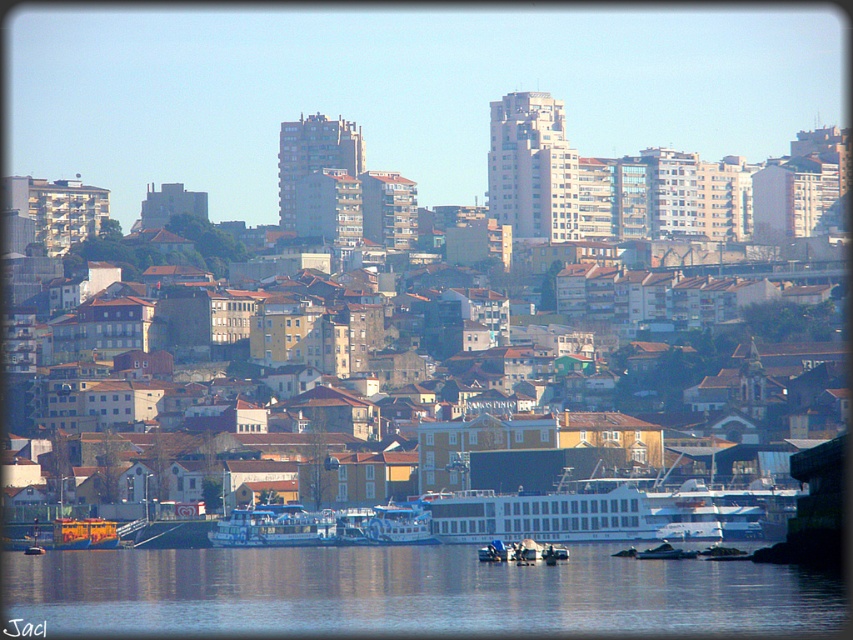
Is transparent water at lower center above blue plastic boat at center?

No.

Is transparent water at lower center smaller than blue plastic boat at center?

Actually, transparent water at lower center might be larger than blue plastic boat at center.

Does point (392, 608) come in front of point (379, 512)?

Yes, it is in front of point (379, 512).

Locate an element on the screen. The image size is (853, 640). transparent water at lower center is located at coordinates (409, 593).

Which is more to the right, blue glossy ferry at center or blue plastic boat at center?

blue plastic boat at center

Which of these two, blue glossy ferry at center or blue plastic boat at center, stands shorter?

blue plastic boat at center

Does point (276, 524) lie behind point (392, 509)?

Yes, point (276, 524) is behind point (392, 509).

Find the location of a particular element. This screenshot has height=640, width=853. blue glossy ferry at center is located at coordinates (273, 525).

Which of these two, transparent water at lower center or blue glossy ferry at center, stands shorter?

blue glossy ferry at center is shorter.

Does transparent water at lower center have a greater width compared to blue glossy ferry at center?

Correct, the width of transparent water at lower center exceeds that of blue glossy ferry at center.

The width and height of the screenshot is (853, 640). In order to click on transparent water at lower center in this screenshot , I will do `click(409, 593)`.